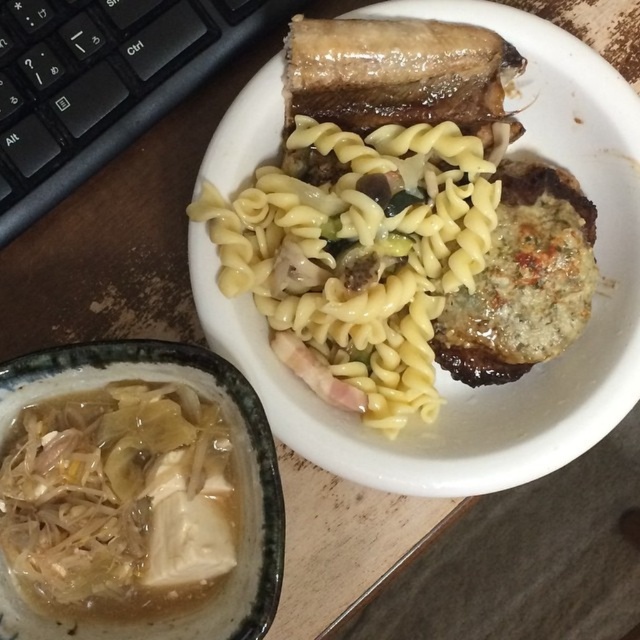
You are a food critic evaluating the arrangement of dishes on the table. Which dish occupies more horizontal space on the table between the yellow glossy pasta at center and the translucent white broth at lower left?

The yellow glossy pasta at center occupies more horizontal space than the translucent white broth at lower left because its width is larger according to the description.

In the scene shown: You are a food critic observing a meal with two pasta dishes. The first is the yellow matte pasta at upper center and the second is the yellow glossy pasta at center. Which pasta dish is located to the right of the other?

The yellow matte pasta at upper center is positioned on the right side of the yellow glossy pasta at center.

Based on the photo, you are a food delivery person who needs to place a hot plate and a bowl on a table without them touching. The plate is the yellow glossy pasta at center and the bowl is the translucent white broth at lower left. Can you safely place them on the table as required?

The distance between the yellow glossy pasta at center and the translucent white broth at lower left is 8.77 inches, so yes, you can safely place them without touching since the space between them is sufficient.